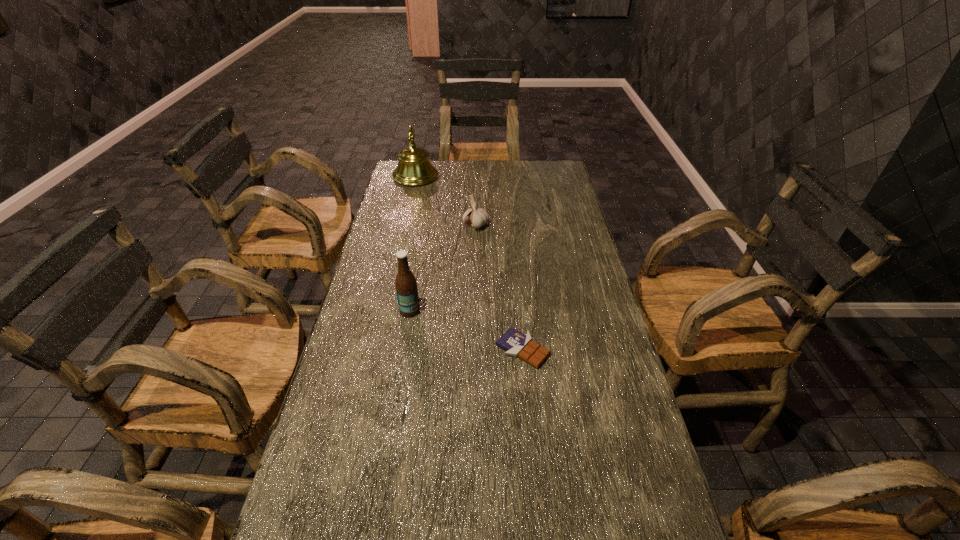
Find the location of a particular element. The image size is (960, 540). bell is located at coordinates (414, 168).

Locate an element on the screen. This screenshot has height=540, width=960. the third farthest object is located at coordinates (405, 283).

The image size is (960, 540). Find the location of `the second shortest object`. the second shortest object is located at coordinates (477, 217).

Find the location of a particular element. the second farthest object is located at coordinates (477, 217).

Locate an element on the screen. Image resolution: width=960 pixels, height=540 pixels. chocolate bar is located at coordinates (517, 344).

What are the coordinates of `the rightmost object` in the screenshot? It's located at (517, 344).

You are a GUI agent. You are given a task and a screenshot of the screen. Output one action in this format:
    pyautogui.click(x=<x>, y=<y>)
    Task: Click on the free spot located 0.260m on the front of the farthest object
    The image size is (960, 540).
    Given the screenshot: What is the action you would take?
    pyautogui.click(x=405, y=222)

The height and width of the screenshot is (540, 960). In order to click on vacant space situated 0.290m on the right of the beer bottle in this screenshot , I will do `click(516, 310)`.

I want to click on free space located on the back of the third tallest object, so click(x=476, y=183).

Locate an element on the screen. vacant space located 0.290m on the left of the chocolate bar is located at coordinates (391, 349).